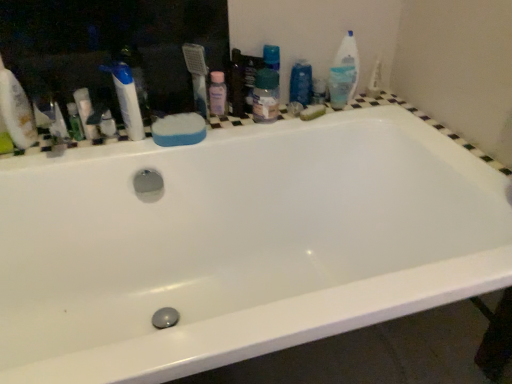
Question: Is green plastic mouthwash at left bigger than white plastic medicine cabinet at upper left?

Choices:
 (A) no
 (B) yes

Answer: (A)

Question: Can you confirm if green plastic mouthwash at left is wider than white plastic medicine cabinet at upper left?

Choices:
 (A) yes
 (B) no

Answer: (A)

Question: Is green plastic mouthwash at left surrounding white plastic medicine cabinet at upper left?

Choices:
 (A) yes
 (B) no

Answer: (B)

Question: Is green plastic mouthwash at left next to white plastic medicine cabinet at upper left?

Choices:
 (A) no
 (B) yes

Answer: (A)

Question: Does green plastic mouthwash at left have a greater height compared to white plastic medicine cabinet at upper left?

Choices:
 (A) yes
 (B) no

Answer: (B)

Question: From a real-world perspective, relative to green plastic mouthwash at left, is green sponge at upper right, the 2th soap positioned from the front, vertically above or below?

Choices:
 (A) below
 (B) above

Answer: (A)

Question: Relative to green plastic mouthwash at left, is green sponge at upper right, which appears as the first soap when viewed from the back, in front or behind?

Choices:
 (A) front
 (B) behind

Answer: (B)

Question: Based on their sizes in the image, would you say green sponge at upper right, which appears as the first soap when viewed from the back, is bigger or smaller than green plastic mouthwash at left?

Choices:
 (A) small
 (B) big

Answer: (A)

Question: Based on their positions, is green sponge at upper right, which appears as the first soap when viewed from the back, located to the left or right of green plastic mouthwash at left?

Choices:
 (A) right
 (B) left

Answer: (A)

Question: Looking at the image, does white matte sponge at left, positioned as the second cleaning product in right-to-left order, seem bigger or smaller compared to pink plastic bottle at upper center, arranged as the second toiletry when viewed from the left?

Choices:
 (A) big
 (B) small

Answer: (A)

Question: Does point (4, 77) appear closer or farther from the camera than point (223, 92)?

Choices:
 (A) farther
 (B) closer

Answer: (B)

Question: In the image, is white matte sponge at left, arranged as the 1th cleaning product when viewed from the front, positioned in front of or behind pink plastic bottle at upper center, arranged as the second toiletry when viewed from the left?

Choices:
 (A) behind
 (B) front

Answer: (B)

Question: In terms of width, does white matte sponge at left, positioned as the second cleaning product in right-to-left order, look wider or thinner when compared to pink plastic bottle at upper center, placed as the fourth toiletry when sorted from right to left?

Choices:
 (A) wide
 (B) thin

Answer: (A)

Question: In the image, is white plastic medicine cabinet at upper left on the left side or the right side of white glossy toothpaste at upper left?

Choices:
 (A) left
 (B) right

Answer: (A)

Question: From a real-world perspective, is white plastic medicine cabinet at upper left positioned above or below white glossy toothpaste at upper left?

Choices:
 (A) above
 (B) below

Answer: (A)